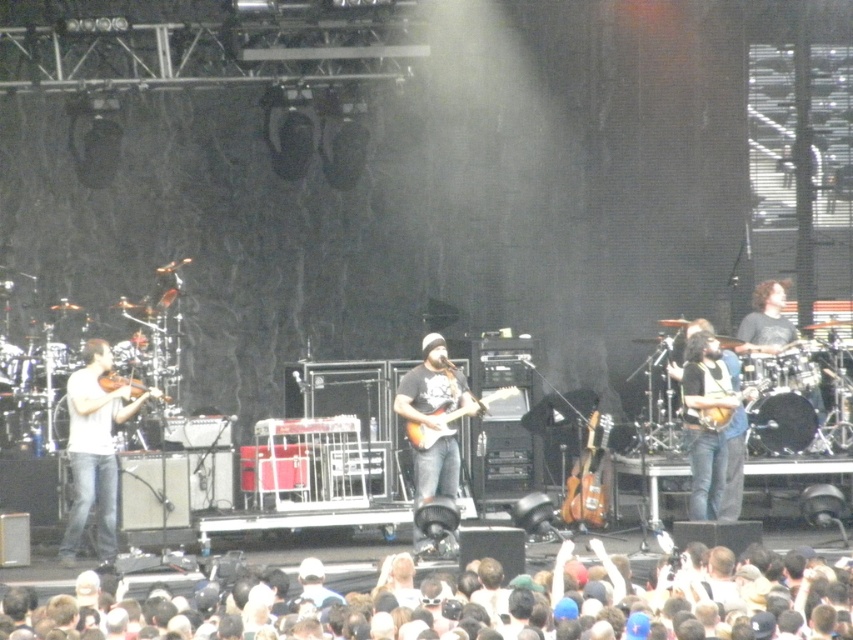
Question: Is white cotton crowd at lower center closer to the viewer compared to brown wood guitar at center?

Choices:
 (A) no
 (B) yes

Answer: (B)

Question: Among these points, which one is farthest from the camera?

Choices:
 (A) (96, 628)
 (B) (421, 433)
 (C) (601, 422)

Answer: (C)

Question: Estimate the real-world distances between objects in this image. Which object is closer to the brown wood guitar at center?

Choices:
 (A) matte brown violin at left
 (B) wooden electric guitar at center
 (C) white cotton crowd at lower center
 (D) wooden acoustic guitar at right

Answer: (B)

Question: Does white matte violin at left lie behind wooden acoustic guitar at right?

Choices:
 (A) yes
 (B) no

Answer: (B)

Question: Does white cotton crowd at lower center lie in front of wooden electric guitar at center?

Choices:
 (A) no
 (B) yes

Answer: (B)

Question: Which point is closer to the camera?

Choices:
 (A) (61, 548)
 (B) (440, 435)
 (C) (138, 381)
 (D) (593, 452)

Answer: (A)